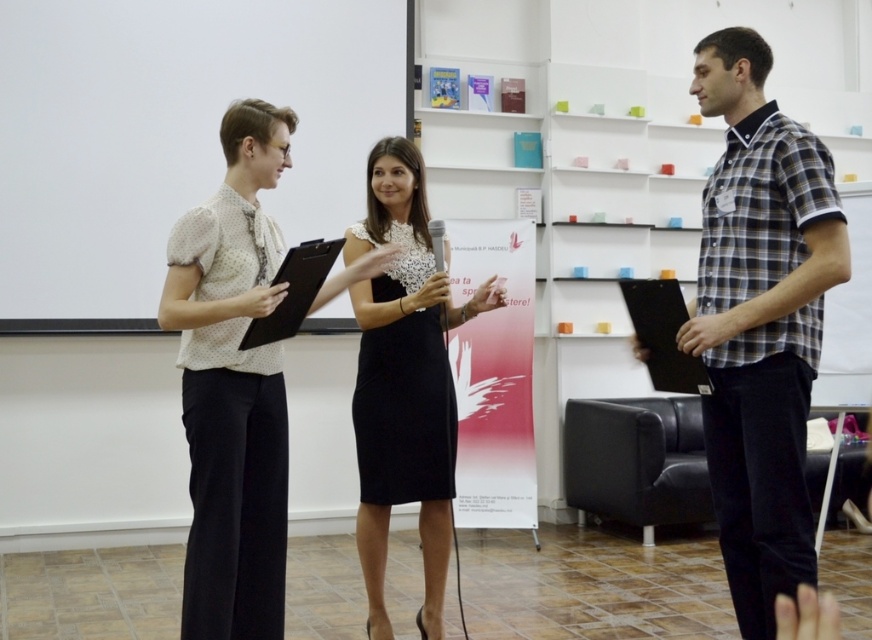
Between point (750, 58) and point (287, 326), which one is positioned in front?

Positioned in front is point (750, 58).

Is checkered fabric shirt at right thinner than black matte clipboard at center?

No.

Between point (784, 368) and point (322, 244), which one is positioned in front?

Point (784, 368)

Image resolution: width=872 pixels, height=640 pixels. In order to click on checkered fabric shirt at right in this screenshot , I will do `click(760, 321)`.

Does white paperboard at center have a greater height compared to checkered fabric shirt at right?

Correct, white paperboard at center is much taller as checkered fabric shirt at right.

Which is more to the left, white paperboard at center or checkered fabric shirt at right?

From the viewer's perspective, white paperboard at center appears more on the left side.

The width and height of the screenshot is (872, 640). What do you see at coordinates (169, 134) in the screenshot? I see `white paperboard at center` at bounding box center [169, 134].

You are a GUI agent. You are given a task and a screenshot of the screen. Output one action in this format:
    pyautogui.click(x=<x>, y=<y>)
    Task: Click on the white paperboard at center
    Image resolution: width=872 pixels, height=640 pixels.
    Given the screenshot: What is the action you would take?
    pyautogui.click(x=169, y=134)

Between point (631, 301) and point (294, 305), which one is positioned in front?

Point (294, 305)

You are a GUI agent. You are given a task and a screenshot of the screen. Output one action in this format:
    pyautogui.click(x=<x>, y=<y>)
    Task: Click on the black matte clipboard at right
    Image resolution: width=872 pixels, height=640 pixels.
    Given the screenshot: What is the action you would take?
    pyautogui.click(x=663, y=333)